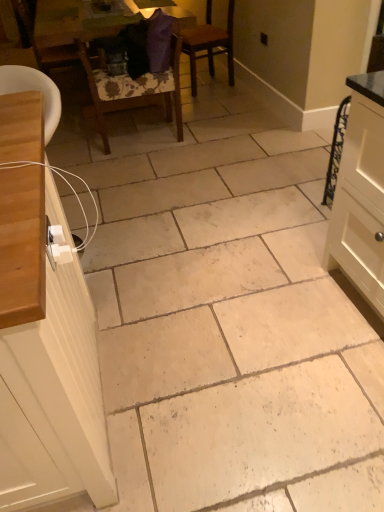
Where is `vacant space underneath wooden chair at center, the 2th chair in the left-to-right sequence (from a real-world perspective)`? The image size is (384, 512). vacant space underneath wooden chair at center, the 2th chair in the left-to-right sequence (from a real-world perspective) is located at coordinates (140, 137).